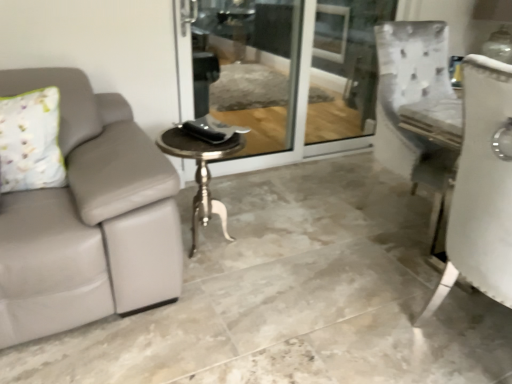
Question: From a real-world perspective, does polished silver table at center stand above clear glass screen door at center?

Choices:
 (A) yes
 (B) no

Answer: (B)

Question: Is polished silver table at center bigger than clear glass screen door at center?

Choices:
 (A) yes
 (B) no

Answer: (B)

Question: Is polished silver table at center taller than clear glass screen door at center?

Choices:
 (A) yes
 (B) no

Answer: (B)

Question: Does polished silver table at center lie in front of clear glass screen door at center?

Choices:
 (A) yes
 (B) no

Answer: (A)

Question: From a real-world perspective, is polished silver table at center under clear glass screen door at center?

Choices:
 (A) yes
 (B) no

Answer: (A)

Question: From the image's perspective, is clear glass screen door at center positioned above or below gray leather couch at left?

Choices:
 (A) above
 (B) below

Answer: (B)

Question: Is clear glass screen door at center to the left or to the right of gray leather couch at left in the image?

Choices:
 (A) right
 (B) left

Answer: (A)

Question: Is clear glass screen door at center wider or thinner than gray leather couch at left?

Choices:
 (A) wide
 (B) thin

Answer: (B)

Question: Is point (346, 150) closer or farther from the camera than point (464, 312)?

Choices:
 (A) farther
 (B) closer

Answer: (A)

Question: Is point (173, 147) positioned closer to the camera than point (323, 77)?

Choices:
 (A) closer
 (B) farther

Answer: (A)

Question: From the image's perspective, relative to clear glass screen door at center, is polished silver table at center above or below?

Choices:
 (A) above
 (B) below

Answer: (B)

Question: Considering the positions of polished silver table at center and clear glass screen door at center in the image, is polished silver table at center wider or thinner than clear glass screen door at center?

Choices:
 (A) thin
 (B) wide

Answer: (B)

Question: Considering their positions, is polished silver table at center located in front of or behind clear glass screen door at center?

Choices:
 (A) behind
 (B) front

Answer: (B)

Question: Is floral fabric pillow at left wider or thinner than polished silver table at center?

Choices:
 (A) thin
 (B) wide

Answer: (A)

Question: From a real-world perspective, is floral fabric pillow at left above or below polished silver table at center?

Choices:
 (A) below
 (B) above

Answer: (B)